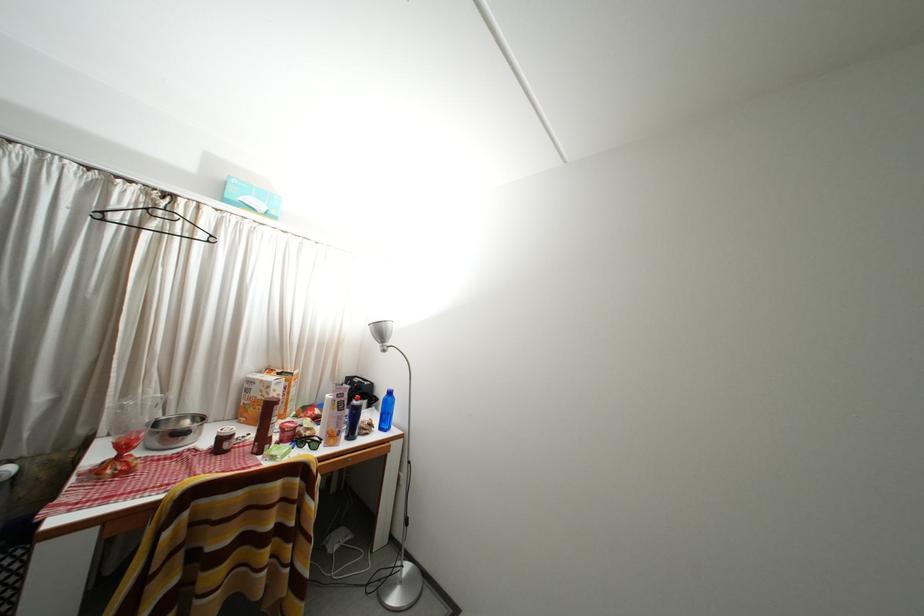
Find where to adjust the silver lamp head. Please return your answer as a coordinate pair (x, y).

(382, 333)